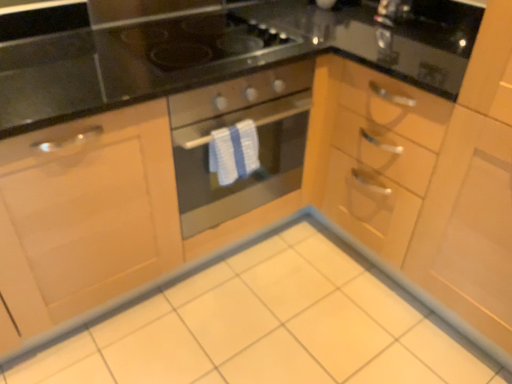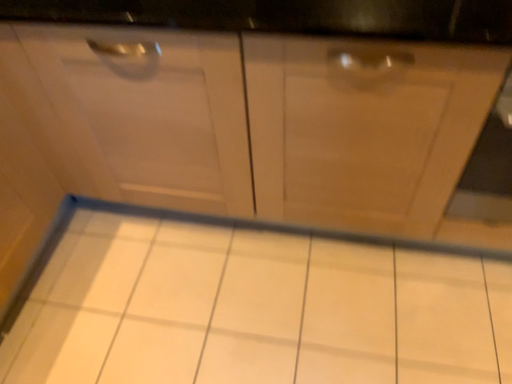
Question: Which way did the camera rotate in the video?

Choices:
 (A) rotated left
 (B) rotated right

Answer: (A)